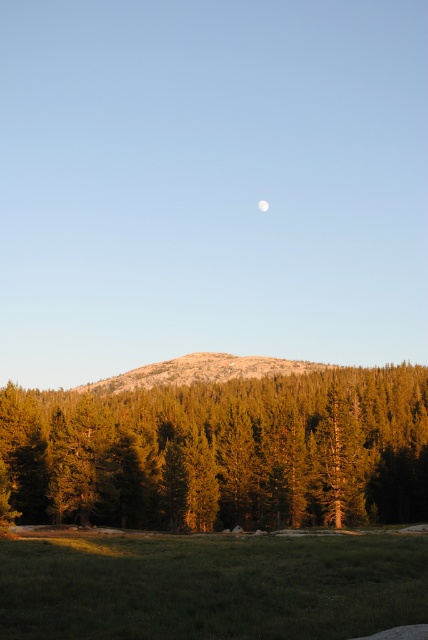
Question: Is green textured tree at center above white matte moon at upper center?

Choices:
 (A) no
 (B) yes

Answer: (A)

Question: Observing the image, what is the correct spatial positioning of green textured tree at center in reference to white matte moon at upper center?

Choices:
 (A) left
 (B) right

Answer: (A)

Question: Is green textured tree at center to the right of granite rock at center from the viewer's perspective?

Choices:
 (A) no
 (B) yes

Answer: (B)

Question: Which object appears closest to the camera in this image?

Choices:
 (A) white matte moon at upper center
 (B) green textured tree at center

Answer: (B)

Question: Which of these objects is positioned closest to the granite rock at center?

Choices:
 (A) green textured tree at center
 (B) white matte moon at upper center

Answer: (A)

Question: Among these points, which one is farthest from the camera?

Choices:
 (A) (255, 449)
 (B) (222, 369)
 (C) (261, 211)

Answer: (C)